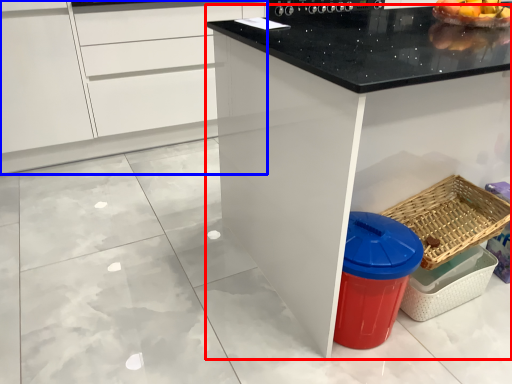
Question: Which point is closer to the camera, countertop (highlighted by a red box) or cabinetry (highlighted by a blue box)?

Choices:
 (A) countertop
 (B) cabinetry

Answer: (A)